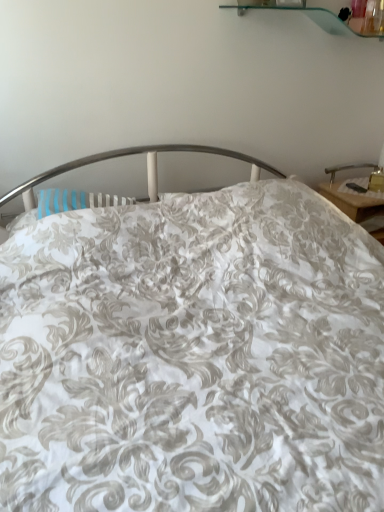
In order to face metallic silver phone at right, should I rotate leftwards or rightwards?

To align with it, rotate right about 21.000°.

The width and height of the screenshot is (384, 512). I want to click on metallic silver phone at right, so click(x=348, y=168).

The width and height of the screenshot is (384, 512). Describe the element at coordinates (348, 168) in the screenshot. I see `metallic silver phone at right` at that location.

Where is `metallic silver phone at right`? metallic silver phone at right is located at coordinates (348, 168).